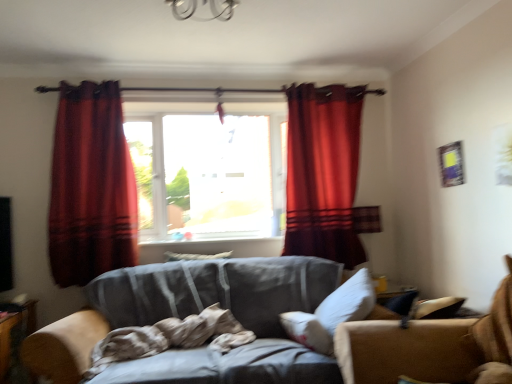
Question: Is velvet red curtain at left, arranged as the first curtain when viewed from the left, at the right side of white soft pillow at center, the second pillow viewed from the top?

Choices:
 (A) no
 (B) yes

Answer: (A)

Question: From the image's perspective, is velvet red curtain at left, arranged as the first curtain when viewed from the left, over white soft pillow at center, placed as the second pillow when sorted from left to right?

Choices:
 (A) yes
 (B) no

Answer: (A)

Question: Is velvet red curtain at left, arranged as the first curtain when viewed from the left, positioned far away from white soft pillow at center, the 1th pillow when ordered from bottom to top?

Choices:
 (A) yes
 (B) no

Answer: (A)

Question: Considering the relative positions of velvet red curtain at left, the 2th curtain in the right-to-left sequence, and white soft pillow at center, the 1th pillow when ordered from bottom to top, in the image provided, is velvet red curtain at left, the 2th curtain in the right-to-left sequence, behind white soft pillow at center, the 1th pillow when ordered from bottom to top,?

Choices:
 (A) no
 (B) yes

Answer: (B)

Question: Is velvet red curtain at left, arranged as the first curtain when viewed from the left, bigger than white soft pillow at center, the second pillow viewed from the top?

Choices:
 (A) yes
 (B) no

Answer: (A)

Question: Can you confirm if velvet red curtain at left, the 2th curtain in the right-to-left sequence, is positioned to the left of white soft pillow at center, which ranks as the first pillow in right-to-left order?

Choices:
 (A) no
 (B) yes

Answer: (B)

Question: Is gray fabric couch at center positioned beyond the bounds of white soft pillow at center, positioned as the first pillow in front-to-back order?

Choices:
 (A) no
 (B) yes

Answer: (B)

Question: Would you consider gray fabric couch at center to be distant from white soft pillow at center, placed as the second pillow when sorted from left to right?

Choices:
 (A) no
 (B) yes

Answer: (A)

Question: Is gray fabric couch at center wider than white soft pillow at center, which ranks as the first pillow in right-to-left order?

Choices:
 (A) yes
 (B) no

Answer: (A)

Question: Can you confirm if gray fabric couch at center is positioned to the left of white soft pillow at center, placed as the second pillow when sorted from left to right?

Choices:
 (A) no
 (B) yes

Answer: (B)

Question: Can you confirm if gray fabric couch at center is bigger than white soft pillow at center, placed as the second pillow when sorted from left to right?

Choices:
 (A) yes
 (B) no

Answer: (A)

Question: From the image's perspective, does gray fabric couch at center appear lower than white soft pillow at center, placed as the second pillow when sorted from left to right?

Choices:
 (A) yes
 (B) no

Answer: (A)

Question: Can you confirm if white soft pillow at center, the 1th pillow when ordered from bottom to top, is smaller than white soft pillow at center, the 1th pillow from the top?

Choices:
 (A) no
 (B) yes

Answer: (A)